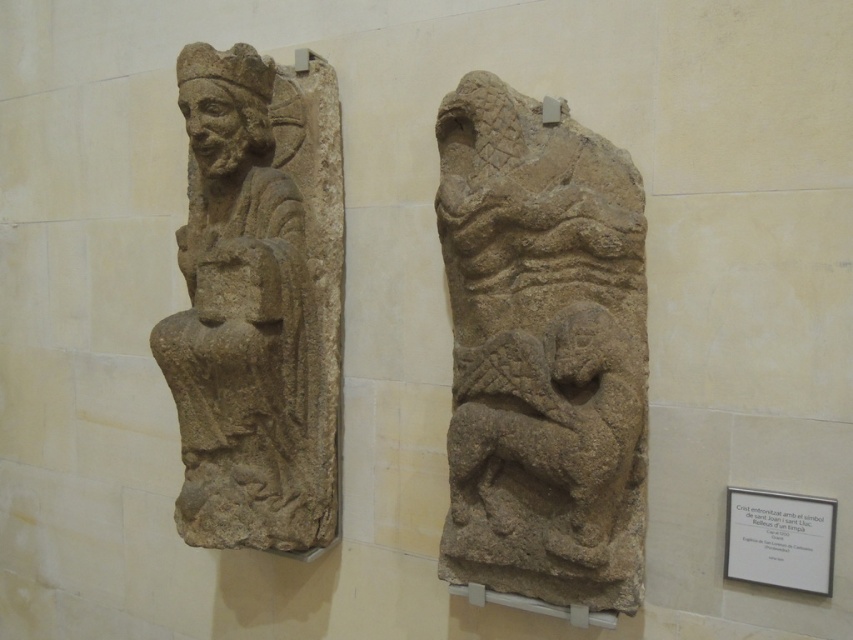
You are an art conservator tasked with measuring the distance between two sculptures in an exhibit. You see the gray stone dragon at right and the stone carving of seated figure at left. Which sculpture is located to the right of the other?

The gray stone dragon at right is positioned on the right side of the stone carving of seated figure at left, so the dragon is to the right of the seated figure.

You are an art conservator examining the two sculptures on the wall. You need to clean the stone carving of seated figure at left and the gray stone dragon at right. Which sculpture should you clean first if you want to start with the one that is positioned lower on the wall?

The gray stone dragon at right is below the stone carving of seated figure at left, so you should clean the gray stone dragon at right first since it is lower on the wall.